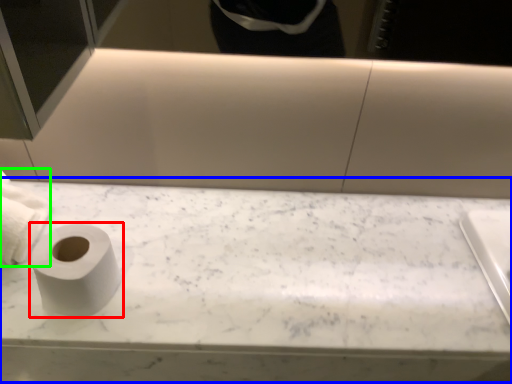
Question: Which object is the closest to the toilet paper (highlighted by a red box)? Choose among these: counter top (highlighted by a blue box) or toilet paper (highlighted by a green box).

Choices:
 (A) counter top
 (B) toilet paper

Answer: (B)